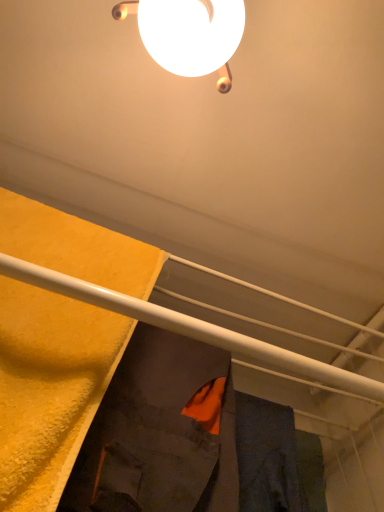
The image size is (384, 512). Describe the element at coordinates (162, 431) in the screenshot. I see `dark gray fabric robe at center, which is counted as the 1th robe, starting from the left` at that location.

This screenshot has width=384, height=512. What do you see at coordinates (267, 457) in the screenshot?
I see `orange fabric at center, marked as the first robe in a right-to-left arrangement` at bounding box center [267, 457].

Find the location of a particular element. Image resolution: width=384 pixels, height=512 pixels. dark gray fabric robe at center, the 2th robe from the right is located at coordinates (162, 431).

Are orange fabric at center, the second robe positioned from the left, and white glossy lamp at upper center beside each other?

No, orange fabric at center, the second robe positioned from the left, is not with white glossy lamp at upper center.

Is point (263, 511) behind point (242, 21)?

Yes, it is behind point (242, 21).

Do you think orange fabric at center, the second robe positioned from the left, is within white glossy lamp at upper center, or outside of it?

orange fabric at center, the second robe positioned from the left, is located beyond the bounds of white glossy lamp at upper center.

From a real-world perspective, is orange fabric at center, the second robe positioned from the left, located beneath white glossy lamp at upper center?

Yes, from a real-world perspective, orange fabric at center, the second robe positioned from the left, is beneath white glossy lamp at upper center.

From the image's perspective, which object appears higher, orange fabric at center, the second robe positioned from the left, or dark gray fabric robe at center, the 2th robe from the right?

dark gray fabric robe at center, the 2th robe from the right, from the image's perspective.

Is point (246, 458) positioned after point (178, 362)?

Yes, point (246, 458) is farther from viewer.

Is orange fabric at center, marked as the first robe in a right-to-left arrangement, looking in the opposite direction of dark gray fabric robe at center, which is counted as the 1th robe, starting from the left?

orange fabric at center, marked as the first robe in a right-to-left arrangement, does not have its back to dark gray fabric robe at center, which is counted as the 1th robe, starting from the left.

Find the location of a particular element. Image resolution: width=384 pixels, height=512 pixels. robe that appears behind the dark gray fabric robe at center, the 2th robe from the right is located at coordinates (267, 457).

Considering the relative sizes of dark gray fabric robe at center, the 2th robe from the right, and orange fabric at center, the second robe positioned from the left, in the image provided, is dark gray fabric robe at center, the 2th robe from the right, bigger than orange fabric at center, the second robe positioned from the left,?

Indeed, dark gray fabric robe at center, the 2th robe from the right, has a larger size compared to orange fabric at center, the second robe positioned from the left.

Considering the relative sizes of dark gray fabric robe at center, which is counted as the 1th robe, starting from the left, and orange fabric at center, the second robe positioned from the left, in the image provided, is dark gray fabric robe at center, which is counted as the 1th robe, starting from the left, thinner than orange fabric at center, the second robe positioned from the left,?

No.

Is orange fabric at center, marked as the first robe in a right-to-left arrangement, at the back of dark gray fabric robe at center, which is counted as the 1th robe, starting from the left?

dark gray fabric robe at center, which is counted as the 1th robe, starting from the left, is not turned away from orange fabric at center, marked as the first robe in a right-to-left arrangement.

Are dark gray fabric robe at center, which is counted as the 1th robe, starting from the left, and orange fabric at center, the second robe positioned from the left, located far from each other?

Actually, dark gray fabric robe at center, which is counted as the 1th robe, starting from the left, and orange fabric at center, the second robe positioned from the left, are a little close together.

From a real-world perspective, between dark gray fabric robe at center, which is counted as the 1th robe, starting from the left, and white glossy lamp at upper center, who is vertically lower?

From a 3D spatial view, dark gray fabric robe at center, which is counted as the 1th robe, starting from the left, is below.

Is dark gray fabric robe at center, the 2th robe from the right, looking in the opposite direction of white glossy lamp at upper center?

No, dark gray fabric robe at center, the 2th robe from the right,'s orientation is not away from white glossy lamp at upper center.

From the image's perspective, is dark gray fabric robe at center, the 2th robe from the right, on top of white glossy lamp at upper center?

Actually, dark gray fabric robe at center, the 2th robe from the right, appears below white glossy lamp at upper center in the image.

Does white glossy lamp at upper center appear on the left side of dark gray fabric robe at center, which is counted as the 1th robe, starting from the left?

A: Incorrect, white glossy lamp at upper center is not on the left side of dark gray fabric robe at center, which is counted as the 1th robe, starting from the left.

From the image's perspective, is white glossy lamp at upper center above or below dark gray fabric robe at center, the 2th robe from the right?

white glossy lamp at upper center is above dark gray fabric robe at center, the 2th robe from the right.

Does white glossy lamp at upper center come in front of dark gray fabric robe at center, which is counted as the 1th robe, starting from the left?

Yes, it is.

From a real-world perspective, does white glossy lamp at upper center sit lower than dark gray fabric robe at center, which is counted as the 1th robe, starting from the left?

No, from a real-world perspective, white glossy lamp at upper center is not below dark gray fabric robe at center, which is counted as the 1th robe, starting from the left.

From the image's perspective, is white glossy lamp at upper center on top of orange fabric at center, marked as the first robe in a right-to-left arrangement?

Yes, from the image's perspective, white glossy lamp at upper center is on top of orange fabric at center, marked as the first robe in a right-to-left arrangement.

This screenshot has height=512, width=384. Find the location of `robe on the right of white glossy lamp at upper center`. robe on the right of white glossy lamp at upper center is located at coordinates (267, 457).

Between white glossy lamp at upper center and orange fabric at center, the second robe positioned from the left, which one appears on the left side from the viewer's perspective?

From the viewer's perspective, white glossy lamp at upper center appears more on the left side.

From the image's perspective, which robe is the 2nd one below the white glossy lamp at upper center? Please provide its 2D coordinates.

[(267, 457)]

Identify the location of robe above the orange fabric at center, the second robe positioned from the left (from the image's perspective). The height and width of the screenshot is (512, 384). (162, 431).

Looking at the image, which one is located further to white glossy lamp at upper center, orange fabric at center, marked as the first robe in a right-to-left arrangement, or dark gray fabric robe at center, which is counted as the 1th robe, starting from the left?

The object further to white glossy lamp at upper center is orange fabric at center, marked as the first robe in a right-to-left arrangement.

Estimate the real-world distances between objects in this image. Which object is closer to orange fabric at center, marked as the first robe in a right-to-left arrangement, dark gray fabric robe at center, the 2th robe from the right, or white glossy lamp at upper center?

The object closer to orange fabric at center, marked as the first robe in a right-to-left arrangement, is dark gray fabric robe at center, the 2th robe from the right.

Estimate the real-world distances between objects in this image. Which object is closer to orange fabric at center, marked as the first robe in a right-to-left arrangement, white glossy lamp at upper center or dark gray fabric robe at center, the 2th robe from the right?

dark gray fabric robe at center, the 2th robe from the right, is positioned closer to the anchor orange fabric at center, marked as the first robe in a right-to-left arrangement.

Based on their spatial positions, is orange fabric at center, marked as the first robe in a right-to-left arrangement, or white glossy lamp at upper center further from dark gray fabric robe at center, the 2th robe from the right?

white glossy lamp at upper center.

When comparing their distances from dark gray fabric robe at center, which is counted as the 1th robe, starting from the left, does white glossy lamp at upper center or orange fabric at center, the second robe positioned from the left, seem further?

white glossy lamp at upper center is further to dark gray fabric robe at center, which is counted as the 1th robe, starting from the left.

Considering their positions, is dark gray fabric robe at center, which is counted as the 1th robe, starting from the left, positioned closer to white glossy lamp at upper center than orange fabric at center, the second robe positioned from the left?

Among the two, dark gray fabric robe at center, which is counted as the 1th robe, starting from the left, is located nearer to white glossy lamp at upper center.

The width and height of the screenshot is (384, 512). I want to click on robe between white glossy lamp at upper center and orange fabric at center, marked as the first robe in a right-to-left arrangement, from top to bottom, so pos(162,431).